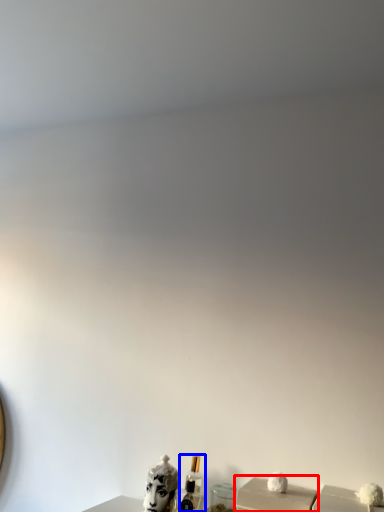
Question: Which object appears farthest to the camera in this image, box (highlighted by a red box) or perfume (highlighted by a blue box)?

Choices:
 (A) box
 (B) perfume

Answer: (B)